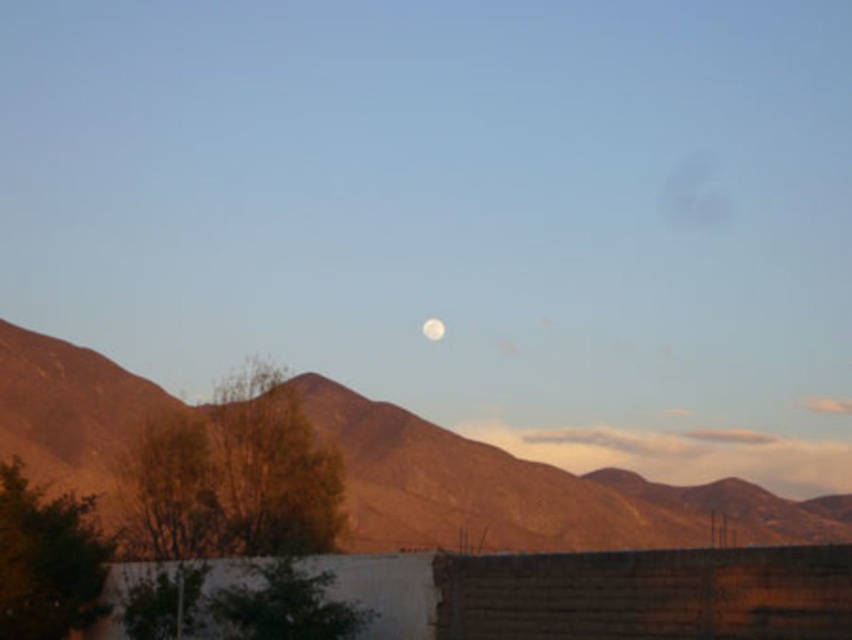
Question: Can you confirm if brown rocky mountain range at center is positioned above white glossy moon at center?

Choices:
 (A) no
 (B) yes

Answer: (A)

Question: Does brown rocky mountain range at center have a larger size compared to white glossy moon at center?

Choices:
 (A) yes
 (B) no

Answer: (A)

Question: Is brown rocky mountain range at center above white glossy moon at center?

Choices:
 (A) yes
 (B) no

Answer: (B)